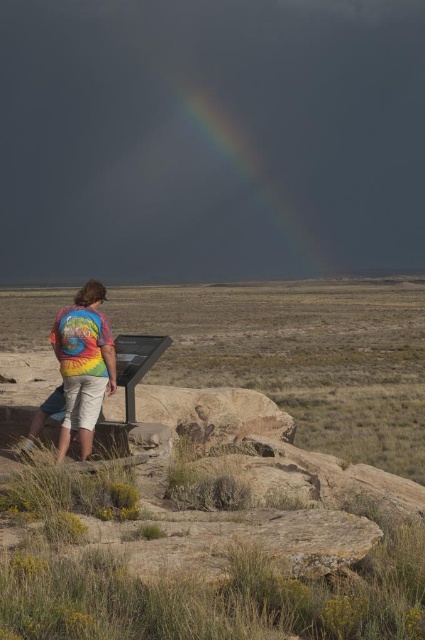
You are a photographer standing at the camera position in the image. You want to capture a closeup shot of the rainbow at upper center. Considering the rainbow is 482.89 feet away, what equipment do you need to ensure the rainbow fills the frame?

To capture a closeup of the rainbow at upper center, which is 482.89 feet away, you would need a telephoto lens with a long focal length to compress the distance and fill the frame with the rainbow.